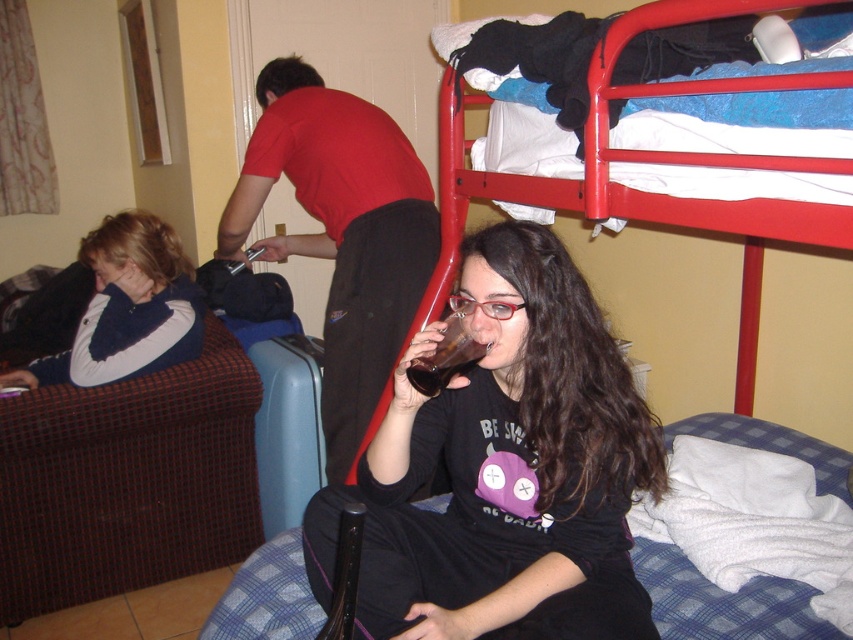
Does matte red shirt at center appear on the left side of translucent glass at center?

Yes, matte red shirt at center is to the left of translucent glass at center.

Identify the location of matte red shirt at center. (341, 232).

Is point (515, 580) positioned after point (456, 356)?

Yes, it is.

Does point (572, 362) come in front of point (440, 355)?

That is False.

Locate an element on the screen. The height and width of the screenshot is (640, 853). matte black shirt at center is located at coordinates (505, 468).

Does red metal bunk bed at upper right appear over translucent glass at center?

Indeed, red metal bunk bed at upper right is positioned over translucent glass at center.

Find the location of a particular element. The height and width of the screenshot is (640, 853). red metal bunk bed at upper right is located at coordinates (662, 163).

At what (x,y) coordinates should I click in order to perform the action: click on red metal bunk bed at upper right. Please return your answer as a coordinate pair (x, y). Looking at the image, I should click on pos(662,163).